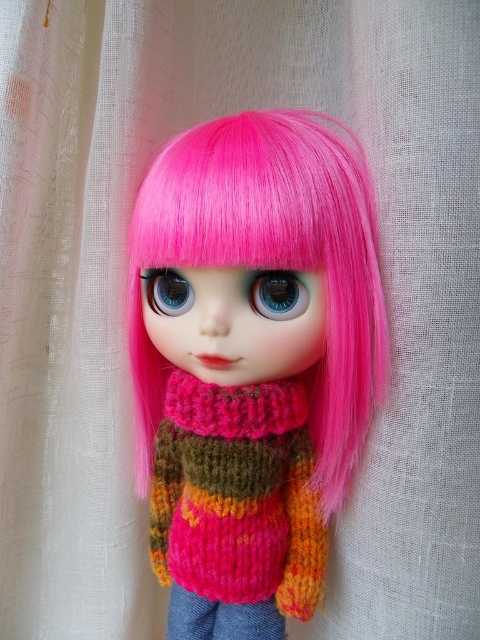
Between knitted wool sweater at center and bluematteeye at center, which one has less height?

bluematteeye at center is shorter.

Consider the image. Is the position of knitted wool sweater at center more distant than that of bluematteeye at center?

That is False.

Is point (272, 548) positioned behind point (141, 285)?

No, (272, 548) is closer to viewer.

Where is `knitted wool sweater at center`? The image size is (480, 640). knitted wool sweater at center is located at coordinates (237, 496).

In the scene shown: Is knitted sweater at center smaller than jeans at center?

No.

Find the location of a particular element. This screenshot has width=480, height=640. knitted sweater at center is located at coordinates (253, 355).

You are a GUI agent. You are given a task and a screenshot of the screen. Output one action in this format:
    pyautogui.click(x=<x>, y=<y>)
    Task: Click on the knitted sweater at center
    Image resolution: width=480 pixels, height=640 pixels.
    Given the screenshot: What is the action you would take?
    pyautogui.click(x=253, y=355)

Is blue glossy eye at center thinner than bluematteeye at center?

Correct, blue glossy eye at center's width is less than bluematteeye at center's.

Is blue glossy eye at center further to the viewer compared to bluematteeye at center?

No, it is not.

This screenshot has height=640, width=480. I want to click on blue glossy eye at center, so click(277, 294).